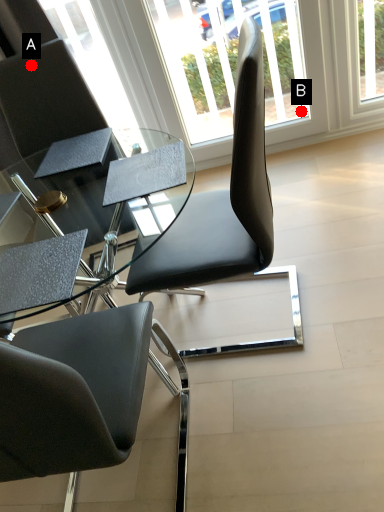
Question: Two points are circled on the image, labeled by A and B beside each circle. Which point is closer to the camera taking this photo?

Choices:
 (A) A is closer
 (B) B is closer

Answer: (A)